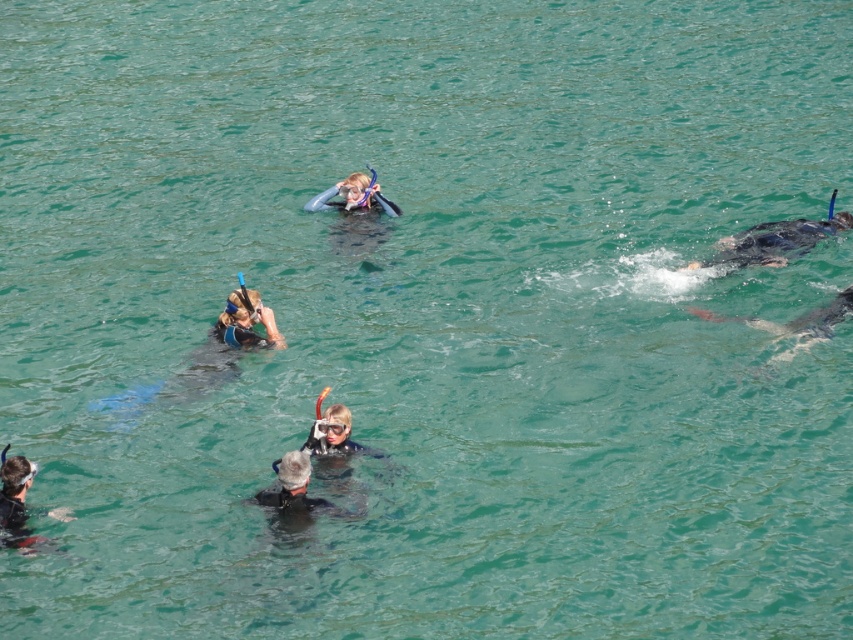
Consider the image. Can you confirm if matte blue snorkel gear at center is wider than smooth gray shark at right?

No, matte blue snorkel gear at center is not wider than smooth gray shark at right.

Can you confirm if matte blue snorkel gear at center is bigger than smooth gray shark at right?

Indeed, matte blue snorkel gear at center has a larger size compared to smooth gray shark at right.

What do you see at coordinates (355, 211) in the screenshot? I see `matte blue snorkel gear at center` at bounding box center [355, 211].

This screenshot has width=853, height=640. I want to click on matte blue snorkel gear at center, so click(x=355, y=211).

Is black rubber snorkeling gear at center further to camera compared to matte black snorkel gear at lower left?

Yes, black rubber snorkeling gear at center is behind matte black snorkel gear at lower left.

Can you confirm if black rubber snorkeling gear at center is taller than matte black snorkel gear at lower left?

In fact, black rubber snorkeling gear at center may be shorter than matte black snorkel gear at lower left.

The width and height of the screenshot is (853, 640). What do you see at coordinates (294, 496) in the screenshot? I see `black rubber snorkeling gear at center` at bounding box center [294, 496].

Locate an element on the screen. The image size is (853, 640). black rubber snorkeling gear at center is located at coordinates (294, 496).

Can you confirm if black rubber snorkeling gear at center is thinner than smooth gray shark at right?

Indeed, black rubber snorkeling gear at center has a lesser width compared to smooth gray shark at right.

Between black rubber snorkeling gear at center and smooth gray shark at right, which one has less height?

With less height is black rubber snorkeling gear at center.

Which is behind, point (294, 502) or point (795, 328)?

The point (795, 328) is behind.

At what (x,y) coordinates should I click in order to perform the action: click on black rubber snorkeling gear at center. Please return your answer as a coordinate pair (x, y). This screenshot has width=853, height=640. Looking at the image, I should click on (294, 496).